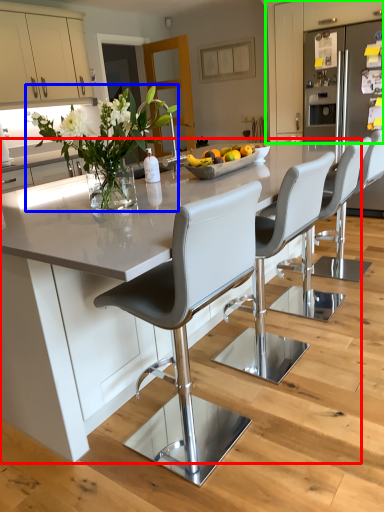
Question: Which object is the farthest from kitchen & dining room table (highlighted by a red box)? Choose among these: floral arrangement (highlighted by a blue box) or cabinetry (highlighted by a green box).

Choices:
 (A) floral arrangement
 (B) cabinetry

Answer: (B)